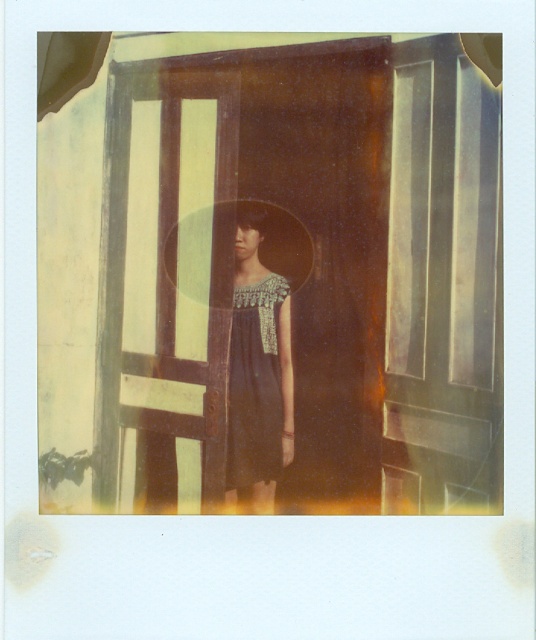
You are taking a photo with a Polaroid camera and want to ensure that the subject is in focus. The camera can only focus on objects within a 10 feet range. Is the point at coordinates point (x=258, y=323) within the camera focus range?

The distance of point (x=258, y=323) from the camera is 11.63 feet, which is beyond the camera focus range of 10 feet. Therefore, the point is out of focus.

Consider the image. You are organizing a fashion show and need to arrange two dresses displayed in the image. The black satin dress at center and the dark blue textured dress at center must be placed on a rack. According to their positions in the photo, which dress should be placed higher on the rack?

The black satin dress at center should be placed higher on the rack because it is located above the dark blue textured dress at center in the image.